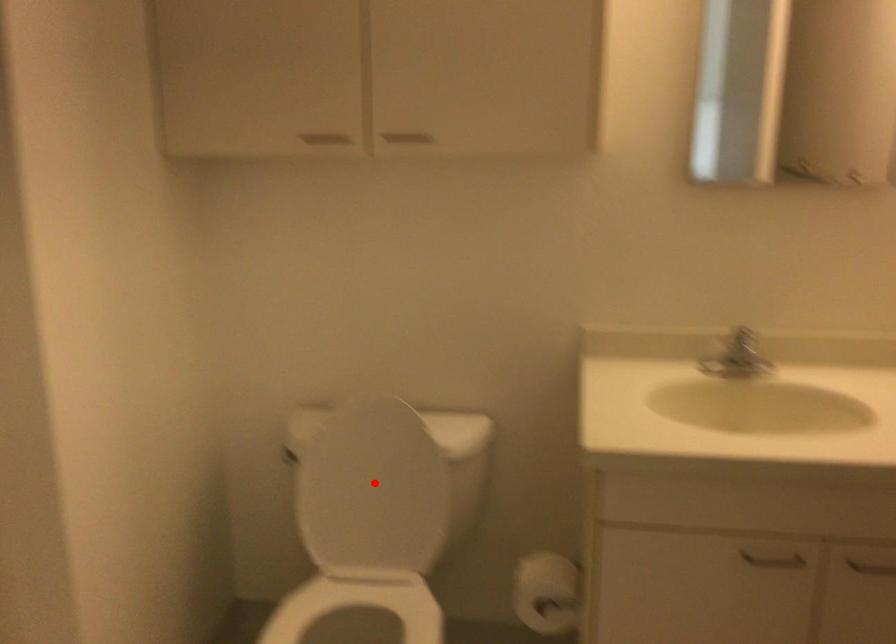
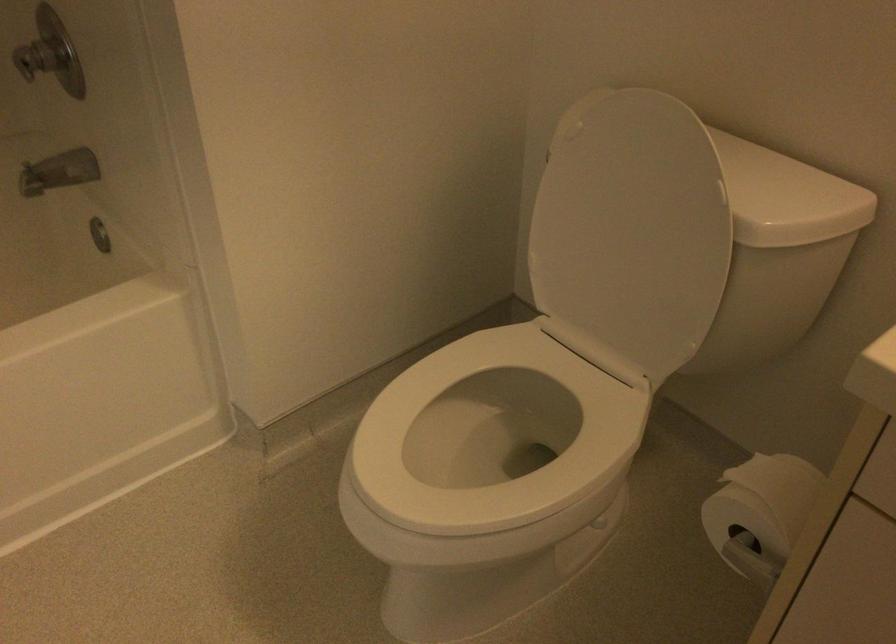
Question: I am providing you with two images of the same scene from different viewpoints. A red point is shown in image1. For the corresponding object point in image2, is it positioned nearer or farther from the camera?

Choices:
 (A) Nearer
 (B) Farther

Answer: (A)